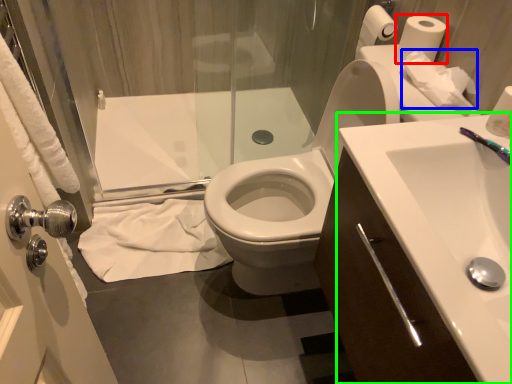
Question: Estimate the real-world distances between objects in this image. Which object is farther from toilet paper (highlighted by a red box), toilet paper (highlighted by a blue box) or sink (highlighted by a green box)?

Choices:
 (A) toilet paper
 (B) sink

Answer: (B)